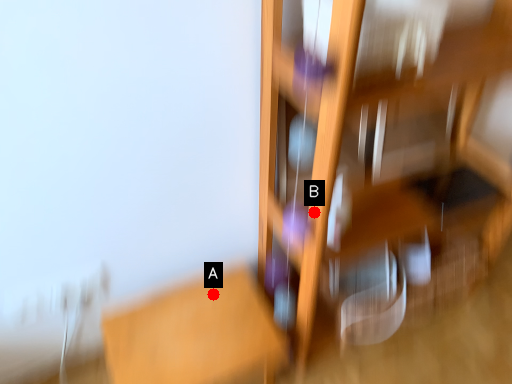
Question: Two points are circled on the image, labeled by A and B beside each circle. Which point is farther to the camera?

Choices:
 (A) A is further
 (B) B is further

Answer: (A)